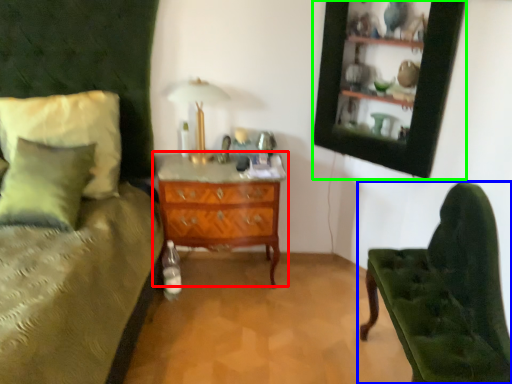
Question: Estimate the real-world distances between objects in this image. Which object is closer to chest of drawers (highlighted by a red box), chair (highlighted by a blue box) or picture frame (highlighted by a green box)?

Choices:
 (A) chair
 (B) picture frame

Answer: (B)